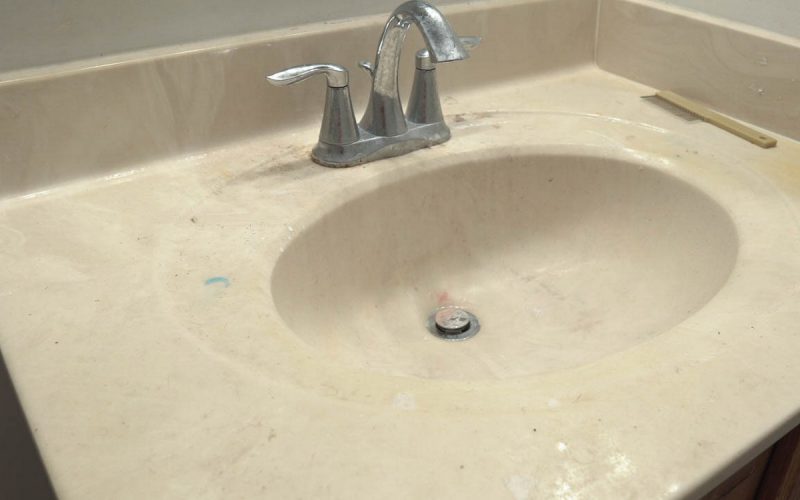
Find the location of a particular element. sink drain is located at coordinates (445, 314).